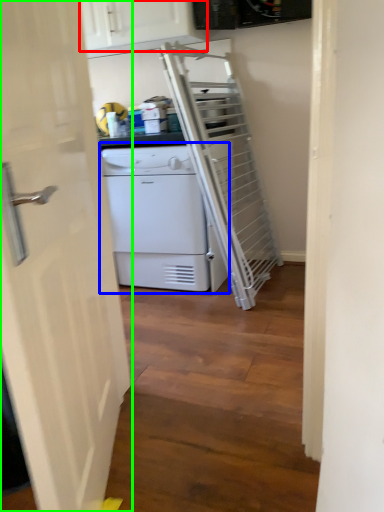
Question: Which object is the closest to the cabinetry (highlighted by a red box)? Choose among these: home appliance (highlighted by a blue box) or door (highlighted by a green box).

Choices:
 (A) home appliance
 (B) door

Answer: (A)